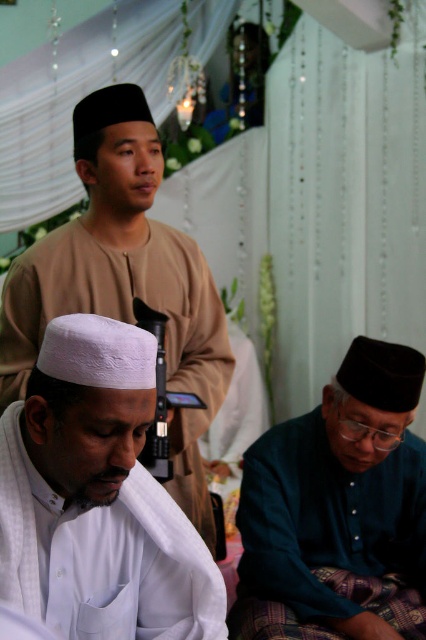
Question: Which object is the farthest from the matte beige robe at center?

Choices:
 (A) dark blue fabric at lower right
 (B) white matte cap at center

Answer: (B)

Question: Which object is farther from the camera taking this photo?

Choices:
 (A) matte beige robe at center
 (B) dark blue fabric at lower right
 (C) white matte cap at center

Answer: (A)

Question: Which point appears farthest from the camera in this image?

Choices:
 (A) [215, 340]
 (B) [71, 548]

Answer: (A)

Question: Does white matte cap at center have a lesser width compared to matte beige robe at center?

Choices:
 (A) no
 (B) yes

Answer: (B)

Question: Does white matte cap at center have a smaller size compared to matte beige robe at center?

Choices:
 (A) yes
 (B) no

Answer: (A)

Question: Is white matte cap at center closer to the viewer compared to dark blue fabric at lower right?

Choices:
 (A) yes
 (B) no

Answer: (A)